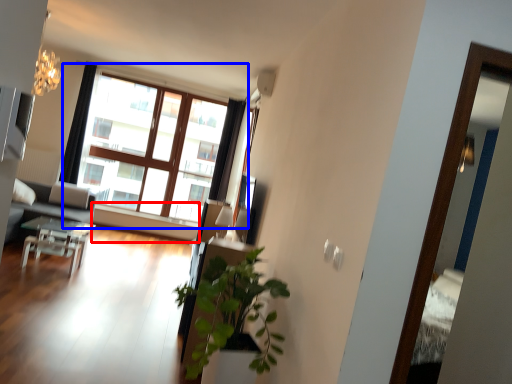
Question: Which of the following is the closest to the observer, window sill (highlighted by a red box) or window (highlighted by a blue box)?

Choices:
 (A) window sill
 (B) window

Answer: (B)